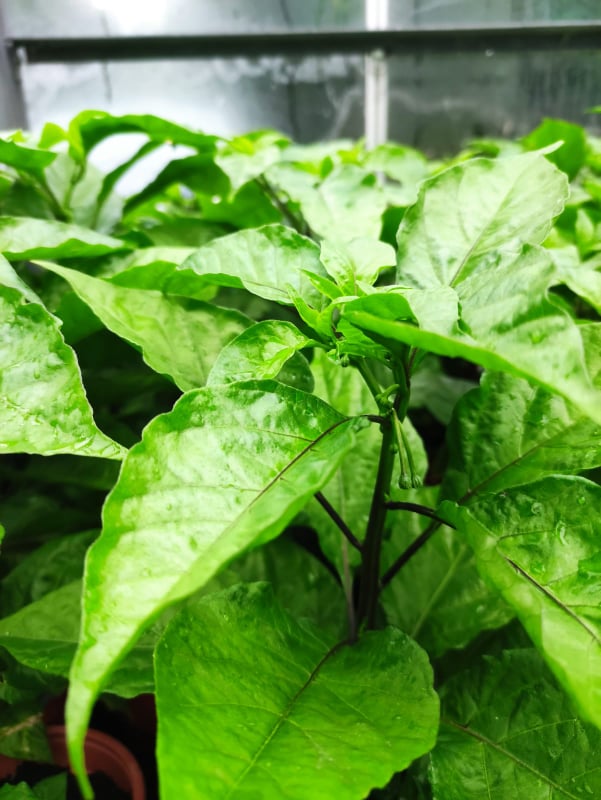
Where is `frame`? This screenshot has height=800, width=601. frame is located at coordinates (208, 42).